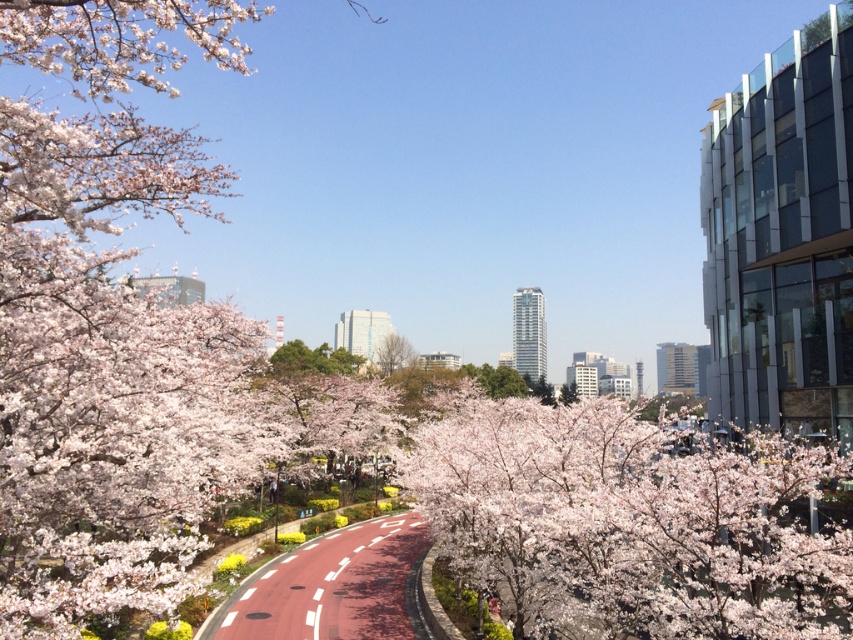
Is pink blossoms at center above green leafy tree at center?

No.

Is pink blossoms at center below green leafy tree at center?

Correct, pink blossoms at center is located below green leafy tree at center.

Between point (409, 468) and point (386, 372), which one is positioned in front?

Point (409, 468) is in front.

The width and height of the screenshot is (853, 640). I want to click on pink blossoms at center, so click(633, 524).